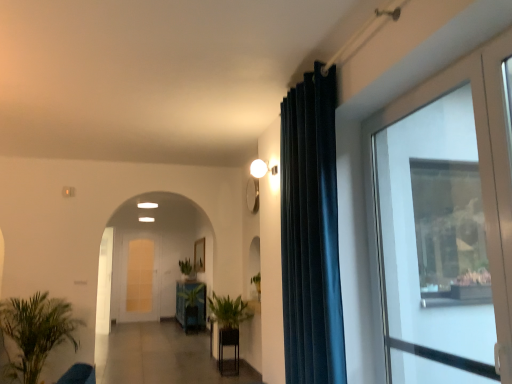
Image resolution: width=512 pixels, height=384 pixels. Identify the location of free space to the left of wooden table at center, placed as the first furniture when sorted from front to back. [x=210, y=372].